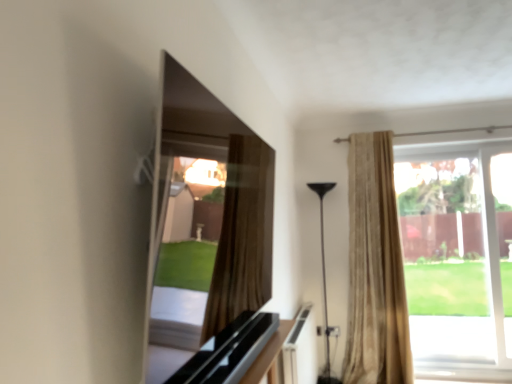
Question: Which is correct: smooth glass tv at upper center is inside beige textured curtain at right, or outside of it?

Choices:
 (A) inside
 (B) outside

Answer: (B)

Question: Is smooth glass tv at upper center in front of or behind beige textured curtain at right in the image?

Choices:
 (A) behind
 (B) front

Answer: (B)

Question: Which object is the closest to the black glossy dresser at center?

Choices:
 (A) black glossy floor lamp at center
 (B) clear glass window at right
 (C) smooth glass tv at upper center
 (D) beige textured curtain at right

Answer: (C)

Question: Estimate the real-world distances between objects in this image. Which object is closer to the black glossy floor lamp at center?

Choices:
 (A) clear glass window at right
 (B) smooth glass tv at upper center
 (C) beige textured curtain at right
 (D) black glossy dresser at center

Answer: (C)